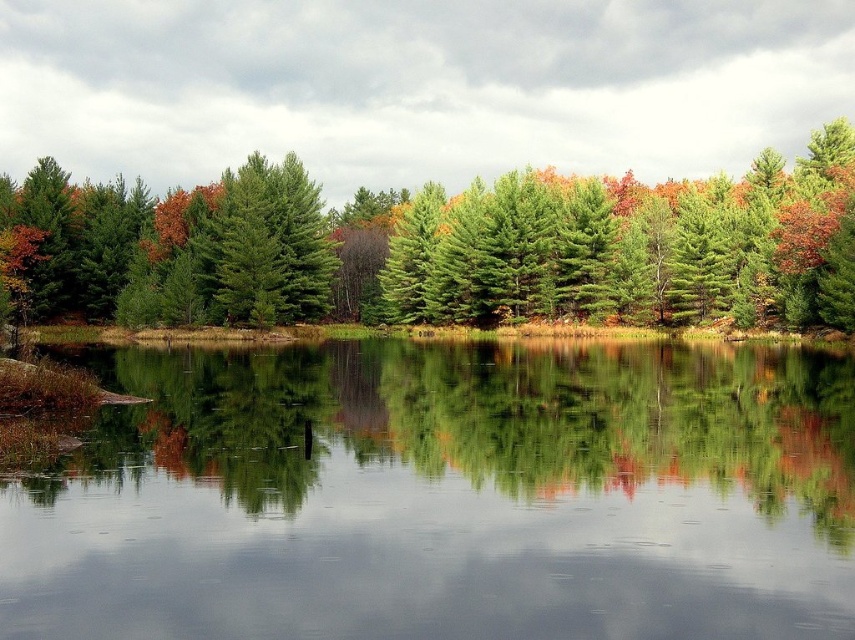
Who is positioned more to the right, smooth reflective water at center or green pine trees at center?

smooth reflective water at center is more to the right.

Image resolution: width=855 pixels, height=640 pixels. Find the location of `smooth reflective water at center`. smooth reflective water at center is located at coordinates (446, 496).

Who is more forward, (355, 524) or (223, 220)?

Point (355, 524)

Image resolution: width=855 pixels, height=640 pixels. Find the location of `smooth reflective water at center`. smooth reflective water at center is located at coordinates (446, 496).